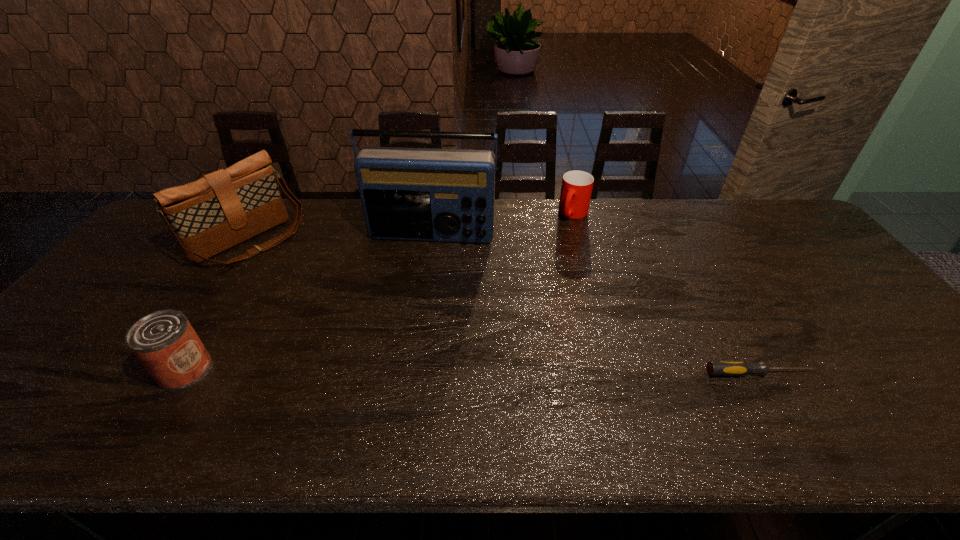
Where is `vacant space that's between the rightmost object and the can`? Image resolution: width=960 pixels, height=540 pixels. vacant space that's between the rightmost object and the can is located at coordinates (471, 371).

What are the coordinates of `vacant area that lies between the can and the second tallest object` in the screenshot? It's located at (217, 306).

Where is `free space between the second tallest object and the can`? The image size is (960, 540). free space between the second tallest object and the can is located at coordinates (217, 306).

Find the location of a particular element. The width and height of the screenshot is (960, 540). free space between the can and the fourth shortest object is located at coordinates (217, 306).

Where is `empty space between the third object from right to left and the shortest object`? empty space between the third object from right to left and the shortest object is located at coordinates [x=595, y=304].

Select which object is the second closest to the shoulder bag. Please provide its 2D coordinates. Your answer should be formatted as a tuple, i.e. [(x, y)], where the tuple contains the x and y coordinates of a point satisfying the conditions above.

[(164, 341)]

Locate an element on the screen. This screenshot has width=960, height=540. object that is the closest one to the tallest object is located at coordinates (224, 208).

Image resolution: width=960 pixels, height=540 pixels. Identify the location of vacant space that satisfies the following two spatial constraints: 1. on the back side of the tallest object; 2. on the right side of the can. (265, 235).

You are a GUI agent. You are given a task and a screenshot of the screen. Output one action in this format:
    pyautogui.click(x=<x>, y=<y>)
    Task: Click on the vacant space that satisfies the following two spatial constraints: 1. on the front side of the cup; 2. insert the shortest object into a screw head
    This screenshot has width=960, height=540.
    Given the screenshot: What is the action you would take?
    pyautogui.click(x=618, y=373)

In order to click on vacant position in the image that satisfies the following two spatial constraints: 1. on the back side of the can; 2. on the right side of the fourth object from left to right in this screenshot , I will do `click(278, 214)`.